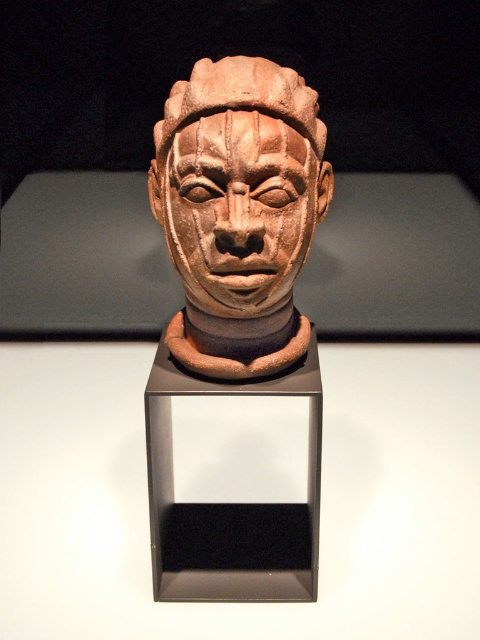
You are an art conservator examining the sculpture. You notice that the matte clay head at center and the terracotta statue at center are positioned in a way that one is partially obscuring the other. Which object is closer to you?

The terracotta statue at center is closer to you because the matte clay head at center is behind it.

You are an art conservator working with the sculpture. You need to place a protective barrier between the terracotta statue at center and the matte clay head at center. What is the minimum width the barrier needs to be to fit between them?

The minimum width of the barrier should be at least 0.69 inches to fit between the terracotta statue at center and the matte clay head at center.